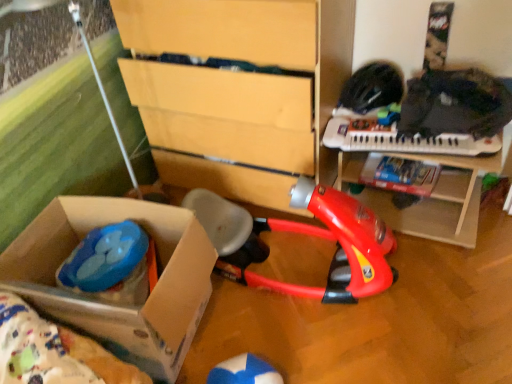
The width and height of the screenshot is (512, 384). I want to click on matte yellow chest of drawers at center, so click(238, 90).

What do you see at coordinates (401, 139) in the screenshot?
I see `white plastic keyboard at upper right` at bounding box center [401, 139].

Find the location of a particular element. blue plastic toy at lower left, which is the second toy from right to left is located at coordinates (112, 265).

Is red plastic vacuum cleaner at center, the 1th toy positioned from the right, placed right next to matte yellow chest of drawers at center?

No, red plastic vacuum cleaner at center, the 1th toy positioned from the right, is not making contact with matte yellow chest of drawers at center.

Does red plastic vacuum cleaner at center, placed as the second toy when sorted from left to right, have a larger size compared to matte yellow chest of drawers at center?

Actually, red plastic vacuum cleaner at center, placed as the second toy when sorted from left to right, might be smaller than matte yellow chest of drawers at center.

Identify the location of the 1st toy behind the matte yellow chest of drawers at center. pyautogui.click(x=306, y=234).

Is red plastic vacuum cleaner at center, placed as the second toy when sorted from left to right, wider or thinner than matte yellow chest of drawers at center?

Considering their sizes, red plastic vacuum cleaner at center, placed as the second toy when sorted from left to right, looks broader than matte yellow chest of drawers at center.

From a real-world perspective, is wooden toy table at center under blue plastic toy at lower left, which is the first toy from left to right?

Indeed, from a real-world perspective, wooden toy table at center is positioned beneath blue plastic toy at lower left, which is the first toy from left to right.

Considering the relative sizes of wooden toy table at center and blue plastic toy at lower left, which is the first toy from left to right, in the image provided, is wooden toy table at center wider than blue plastic toy at lower left, which is the first toy from left to right,?

Correct, the width of wooden toy table at center exceeds that of blue plastic toy at lower left, which is the first toy from left to right.

Considering the relative sizes of wooden toy table at center and blue plastic toy at lower left, which is the second toy from right to left, in the image provided, is wooden toy table at center taller than blue plastic toy at lower left, which is the second toy from right to left,?

Indeed, wooden toy table at center has a greater height compared to blue plastic toy at lower left, which is the second toy from right to left.

In terms of height, does wooden toy table at center look taller or shorter compared to cardboard box at lower left?

Considering their sizes, wooden toy table at center has less height than cardboard box at lower left.

From the picture: Measure the distance between wooden toy table at center and cardboard box at lower left.

The distance of wooden toy table at center from cardboard box at lower left is 35.98 inches.

Is wooden toy table at center oriented towards cardboard box at lower left?

No, wooden toy table at center is not turned towards cardboard box at lower left.

Is wooden toy table at center touching cardboard box at lower left?

No, wooden toy table at center is not beside cardboard box at lower left.

The image size is (512, 384). What are the coordinates of `table below the cardboard box at lower left (from a real-world perspective)` in the screenshot? It's located at pos(440,201).

Looking at this image, is cardboard box at lower left positioned far away from wooden toy table at center?

Actually, cardboard box at lower left and wooden toy table at center are a little close together.

From the image's perspective, which one is positioned lower, cardboard box at lower left or wooden toy table at center?

cardboard box at lower left, from the image's perspective.

Who is bigger, cardboard box at lower left or wooden toy table at center?

With larger size is cardboard box at lower left.

Is blue plastic toy at lower left, which is the second toy from right to left, positioned far away from cardboard box at lower left?

That's not correct — blue plastic toy at lower left, which is the second toy from right to left, is a little close to cardboard box at lower left.

Does blue plastic toy at lower left, which is the first toy from left to right, have a greater height compared to cardboard box at lower left?

Incorrect, the height of blue plastic toy at lower left, which is the first toy from left to right, is not larger of that of cardboard box at lower left.

This screenshot has height=384, width=512. Find the location of `box located on the right of blue plastic toy at lower left, which is the first toy from left to right`. box located on the right of blue plastic toy at lower left, which is the first toy from left to right is located at coordinates (117, 301).

Could you measure the distance between blue plastic toy at lower left, which is the first toy from left to right, and cardboard box at lower left?

A distance of 4.51 inches exists between blue plastic toy at lower left, which is the first toy from left to right, and cardboard box at lower left.

Considering the relative sizes of white plastic keyboard at upper right and matte yellow chest of drawers at center in the image provided, is white plastic keyboard at upper right thinner than matte yellow chest of drawers at center?

Correct, the width of white plastic keyboard at upper right is less than that of matte yellow chest of drawers at center.

From the image's perspective, who appears lower, white plastic keyboard at upper right or matte yellow chest of drawers at center?

→ white plastic keyboard at upper right appears lower in the image.

Is blue plastic toy at lower left, which is the first toy from left to right, bigger or smaller than white plastic keyboard at upper right?

Considering their sizes, blue plastic toy at lower left, which is the first toy from left to right, takes up more space than white plastic keyboard at upper right.

In the scene shown: Does blue plastic toy at lower left, which is the second toy from right to left, have a lesser height compared to white plastic keyboard at upper right?

No, blue plastic toy at lower left, which is the second toy from right to left, is not shorter than white plastic keyboard at upper right.

Between blue plastic toy at lower left, which is the second toy from right to left, and white plastic keyboard at upper right, which one appears on the right side from the viewer's perspective?

white plastic keyboard at upper right.

Looking at this image, from the image's perspective, is blue plastic toy at lower left, which is the second toy from right to left, on top of white plastic keyboard at upper right?

No, from the image's perspective, blue plastic toy at lower left, which is the second toy from right to left, is not above white plastic keyboard at upper right.

This screenshot has height=384, width=512. What are the coordinates of `the 1st toy behind the matte yellow chest of drawers at center` in the screenshot? It's located at click(306, 234).

What are the coordinates of `the 2nd toy to the left when counting from the wooden toy table at center` in the screenshot? It's located at (112, 265).

Considering their positions, is matte yellow chest of drawers at center positioned further to red plastic vacuum cleaner at center, placed as the second toy when sorted from left to right, than wooden toy table at center?

The object further to red plastic vacuum cleaner at center, placed as the second toy when sorted from left to right, is matte yellow chest of drawers at center.

From the image, which object appears to be nearer to blue plastic toy at lower left, which is the second toy from right to left, wooden toy table at center or red plastic vacuum cleaner at center, the 1th toy positioned from the right?

red plastic vacuum cleaner at center, the 1th toy positioned from the right, lies closer to blue plastic toy at lower left, which is the second toy from right to left, than the other object.

From the image, which object appears to be farther from white plastic keyboard at upper right, cardboard box at lower left or red plastic vacuum cleaner at center, placed as the second toy when sorted from left to right?

cardboard box at lower left lies further to white plastic keyboard at upper right than the other object.

Based on their spatial positions, is matte yellow chest of drawers at center or cardboard box at lower left further from red plastic vacuum cleaner at center, the 1th toy positioned from the right?

cardboard box at lower left.

Which object lies nearer to the anchor point matte yellow chest of drawers at center, blue plastic toy at lower left, which is the second toy from right to left, or cardboard box at lower left?

Based on the image, cardboard box at lower left appears to be nearer to matte yellow chest of drawers at center.

Looking at the image, which one is located further to red plastic vacuum cleaner at center, the 1th toy positioned from the right, cardboard box at lower left or white plastic keyboard at upper right?

cardboard box at lower left is positioned further to the anchor red plastic vacuum cleaner at center, the 1th toy positioned from the right.

Estimate the real-world distances between objects in this image. Which object is closer to blue plastic toy at lower left, which is the first toy from left to right, matte yellow chest of drawers at center or white plastic keyboard at upper right?

The object closer to blue plastic toy at lower left, which is the first toy from left to right, is matte yellow chest of drawers at center.

Based on their spatial positions, is red plastic vacuum cleaner at center, the 1th toy positioned from the right, or cardboard box at lower left closer to wooden toy table at center?

red plastic vacuum cleaner at center, the 1th toy positioned from the right, is positioned closer to the anchor wooden toy table at center.

I want to click on toy situated between matte yellow chest of drawers at center and wooden toy table at center from left to right, so coord(306,234).

This screenshot has height=384, width=512. In order to click on box located between blue plastic toy at lower left, which is the first toy from left to right, and white plastic keyboard at upper right in the left-right direction in this screenshot , I will do `click(117, 301)`.

Locate an element on the screen. The width and height of the screenshot is (512, 384). toy between matte yellow chest of drawers at center and blue plastic toy at lower left, which is the first toy from left to right, in the vertical direction is located at coordinates (306, 234).

This screenshot has width=512, height=384. I want to click on the chest of drawers located between blue plastic toy at lower left, which is the second toy from right to left, and white plastic keyboard at upper right in the left-right direction, so click(238, 90).